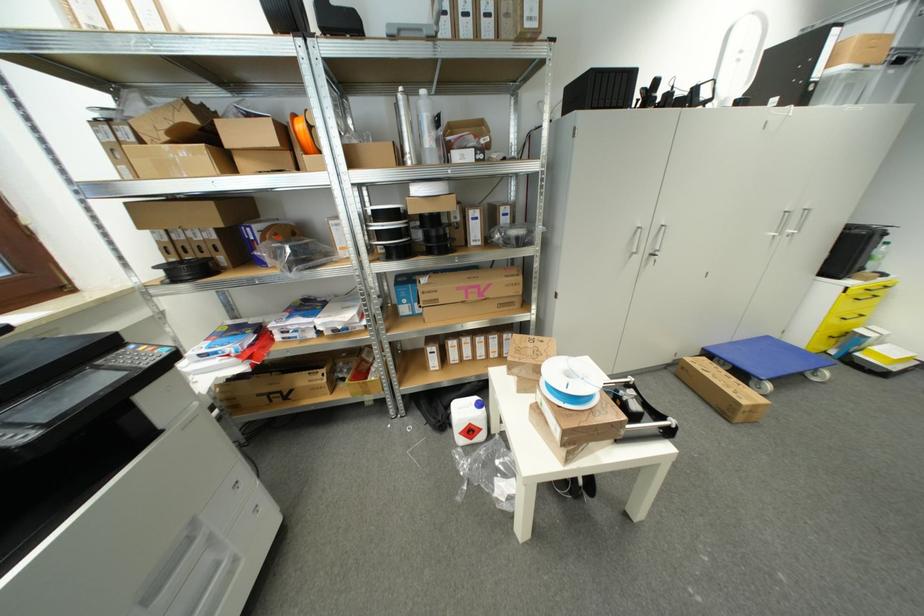
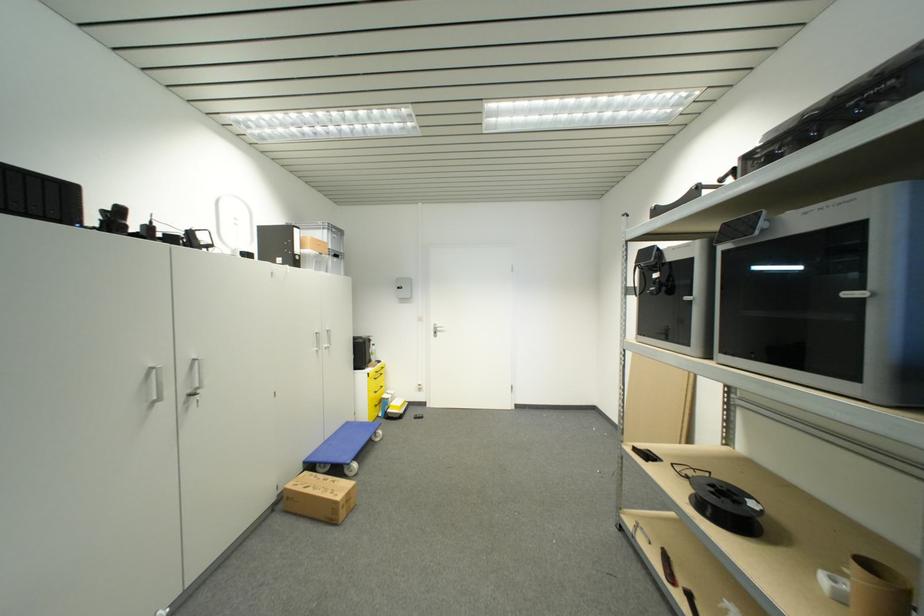
Question: The first image is from the beginning of the video and the second image is from the end. How did the camera likely rotate when shooting the video?

Choices:
 (A) Left
 (B) Right
 (C) Up
 (D) Down

Answer: (B)